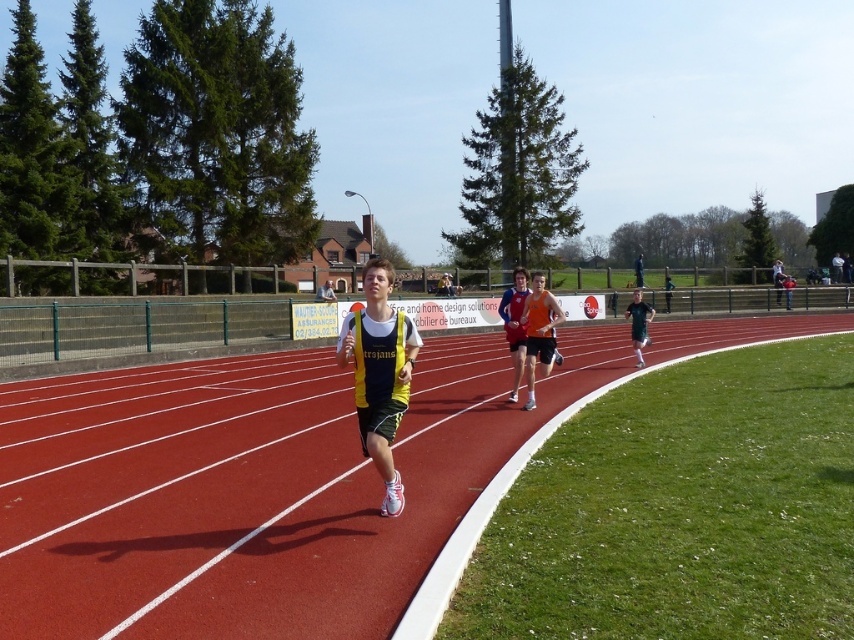
You are a photographer standing at the athletics field and want to capture a closeup of the red rubber track at center. Your camera can focus on objects within 4 meters. Can you get a clear shot without moving closer?

The red rubber track at center is 4.35 meters from viewer, which is beyond the camera focus range of 4 meters. So you need to move closer to get a clear shot.